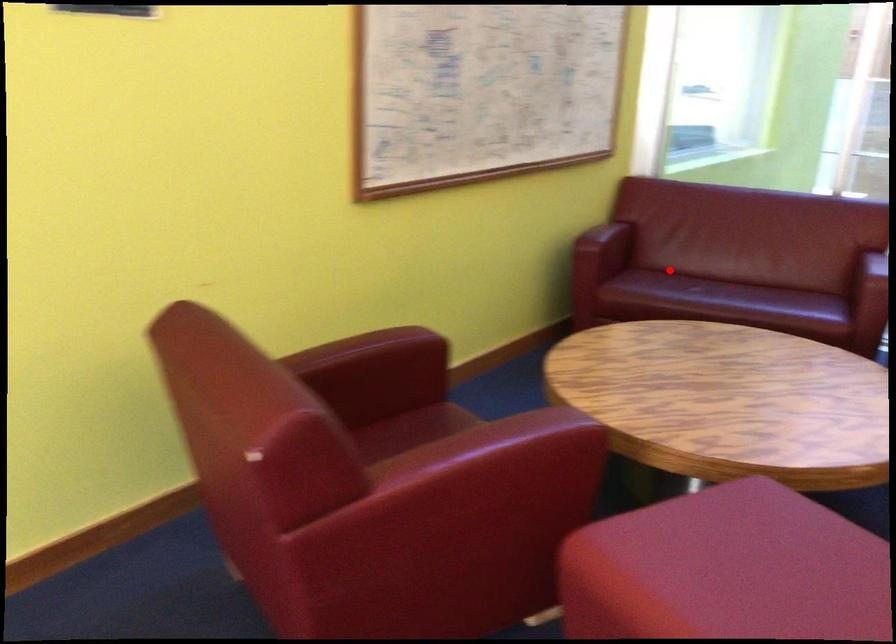
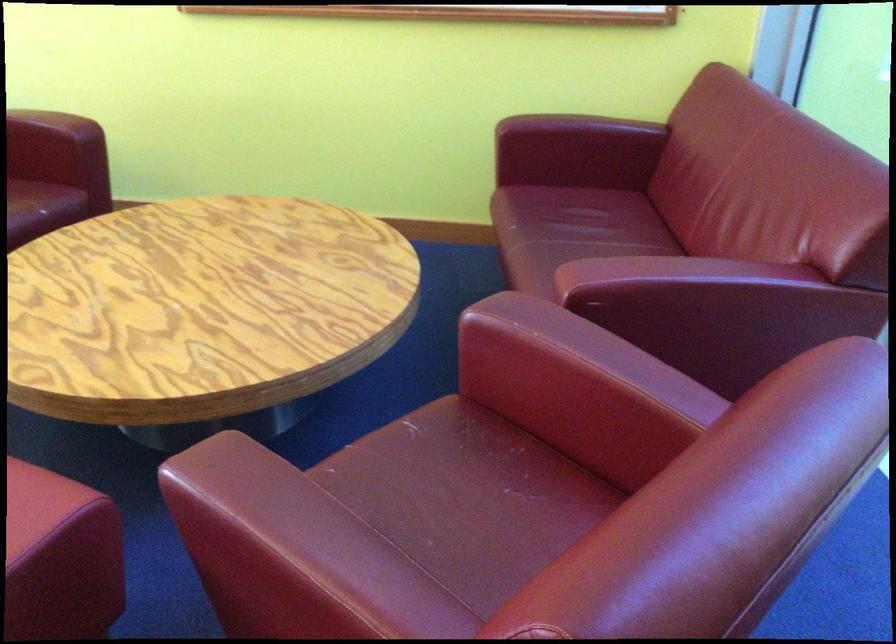
Question: I am providing you with two images of the same scene from different viewpoints. A red point is marked on the first image. Is the red point's position out of view in image 2?

Choices:
 (A) Yes
 (B) No

Answer: (B)